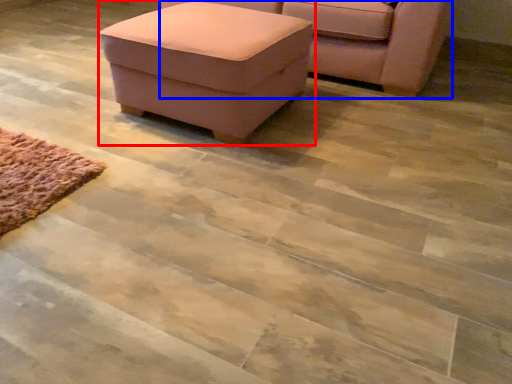
Question: Which object is closer to the camera taking this photo, table (highlighted by a red box) or chair (highlighted by a blue box)?

Choices:
 (A) table
 (B) chair

Answer: (A)